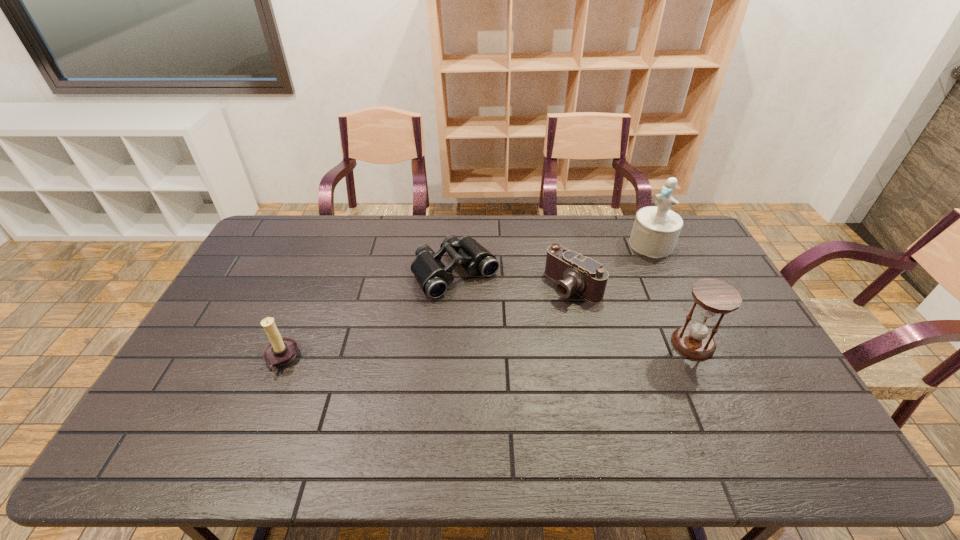
Find the location of a particular element. This screenshot has height=540, width=960. the third tallest object is located at coordinates (280, 351).

You are a GUI agent. You are given a task and a screenshot of the screen. Output one action in this format:
    pyautogui.click(x=<x>, y=<y>)
    Task: Click on the candle holder
    Image resolution: width=960 pixels, height=540 pixels.
    Given the screenshot: What is the action you would take?
    pyautogui.click(x=280, y=351)

You are a GUI agent. You are given a task and a screenshot of the screen. Output one action in this format:
    pyautogui.click(x=<x>, y=<y>)
    Task: Click on the hourglass
    Image resolution: width=960 pixels, height=540 pixels.
    Given the screenshot: What is the action you would take?
    pyautogui.click(x=714, y=297)

Identify the location of the third object from right to left. Image resolution: width=960 pixels, height=540 pixels. click(584, 276).

Identify the location of figurine. (656, 229).

The width and height of the screenshot is (960, 540). What are the coordinates of `the fourth object from right to left` in the screenshot? It's located at (433, 276).

You are a GUI agent. You are given a task and a screenshot of the screen. Output one action in this format:
    pyautogui.click(x=<x>, y=<y>)
    Task: Click on the vacant space located 0.210m on the wick of the third tallest object
    
    Given the screenshot: What is the action you would take?
    pyautogui.click(x=190, y=360)

This screenshot has height=540, width=960. What are the coordinates of `free space located on the wick of the third tallest object` in the screenshot? It's located at (198, 360).

This screenshot has width=960, height=540. In order to click on vacant space located on the wick of the third tallest object in this screenshot , I will do `click(248, 360)`.

Find the location of a particular element. The image size is (960, 540). vacant space situated on the back of the second tallest object is located at coordinates (657, 264).